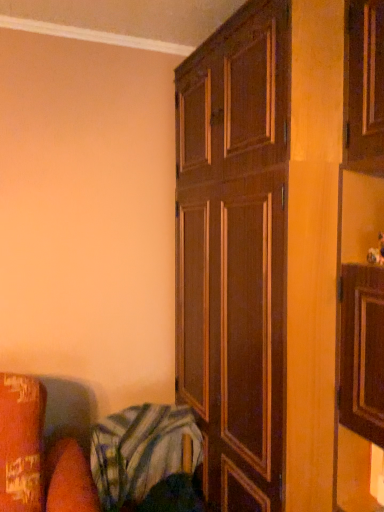
Consider the image. What is the approximate width of striped cotton blanket at lower left?

It is 12.51 inches.

Describe the element at coordinates (146, 460) in the screenshot. This screenshot has height=512, width=384. I see `striped cotton blanket at lower left` at that location.

Consider the image. Measure the distance between point [130,485] and camera.

Point [130,485] is 1.72 meters away from camera.

You are a GUI agent. You are given a task and a screenshot of the screen. Output one action in this format:
    pyautogui.click(x=<x>, y=<y>)
    Task: Click on the striped cotton blanket at lower left
    The width and height of the screenshot is (384, 512).
    Given the screenshot: What is the action you would take?
    pyautogui.click(x=146, y=460)

What do you see at coordinates (279, 248) in the screenshot?
I see `dark wood cupboard at center` at bounding box center [279, 248].

In order to face dark wood cupboard at center, should I rotate leftwards or rightwards?

Rotate your view right by about 11.640°.

Locate an element on the screen. dark wood cupboard at center is located at coordinates (279, 248).

Locate an element on the screen. This screenshot has width=384, height=512. striped cotton blanket at lower left is located at coordinates (146, 460).

Which is more to the right, striped cotton blanket at lower left or dark wood cupboard at center?

Positioned to the right is dark wood cupboard at center.

Between striped cotton blanket at lower left and dark wood cupboard at center, which one is positioned in front?

Positioned in front is dark wood cupboard at center.

Which is farther from the camera, [142,468] or [354,182]?

The point [142,468] is farther.

Based on the photo, from the image's perspective, which is below, striped cotton blanket at lower left or dark wood cupboard at center?

striped cotton blanket at lower left is shown below in the image.

From a real-world perspective, is striped cotton blanket at lower left on dark wood cupboard at center?

No, from a real-world perspective, striped cotton blanket at lower left is not over dark wood cupboard at center

Can you confirm if striped cotton blanket at lower left is thinner than dark wood cupboard at center?

Yes, striped cotton blanket at lower left is thinner than dark wood cupboard at center.

Which of these two, striped cotton blanket at lower left or dark wood cupboard at center, stands shorter?

Standing shorter between the two is striped cotton blanket at lower left.

Considering the relative sizes of striped cotton blanket at lower left and dark wood cupboard at center in the image provided, is striped cotton blanket at lower left bigger than dark wood cupboard at center?

No.

Is dark wood cupboard at center completely or partially inside striped cotton blanket at lower left?

No.

Does striped cotton blanket at lower left touch dark wood cupboard at center?

No, striped cotton blanket at lower left is not touching dark wood cupboard at center.

Is striped cotton blanket at lower left oriented away from dark wood cupboard at center?

striped cotton blanket at lower left is not turned away from dark wood cupboard at center.

How different are the orientations of striped cotton blanket at lower left and dark wood cupboard at center in degrees?

striped cotton blanket at lower left and dark wood cupboard at center are facing 90.8 degrees away from each other.

How much distance is there between striped cotton blanket at lower left and dark wood cupboard at center?

striped cotton blanket at lower left and dark wood cupboard at center are 21.15 inches apart.

Identify the location of cupboard above the striped cotton blanket at lower left (from a real-world perspective). This screenshot has height=512, width=384. (279, 248).

Considering the relative positions of dark wood cupboard at center and striped cotton blanket at lower left in the image provided, is dark wood cupboard at center to the right of striped cotton blanket at lower left from the viewer's perspective?

Yes, dark wood cupboard at center is to the right of striped cotton blanket at lower left.

From the picture: Considering the positions of objects dark wood cupboard at center and striped cotton blanket at lower left in the image provided, who is in front, dark wood cupboard at center or striped cotton blanket at lower left?

Positioned in front is dark wood cupboard at center.

Does point (179, 390) come farther from viewer compared to point (199, 460)?

Yes, point (179, 390) is farther from viewer.

From the image's perspective, which object appears higher, dark wood cupboard at center or striped cotton blanket at lower left?

dark wood cupboard at center is shown above in the image.

Looking at this image, from a real-world perspective, is dark wood cupboard at center located beneath striped cotton blanket at lower left?

No, from a real-world perspective, dark wood cupboard at center is not under striped cotton blanket at lower left.

Between dark wood cupboard at center and striped cotton blanket at lower left, which one has larger width?

dark wood cupboard at center is wider.

From their relative heights in the image, would you say dark wood cupboard at center is taller or shorter than striped cotton blanket at lower left?

Clearly, dark wood cupboard at center is taller compared to striped cotton blanket at lower left.

Can you confirm if dark wood cupboard at center is smaller than striped cotton blanket at lower left?

Incorrect, dark wood cupboard at center is not smaller in size than striped cotton blanket at lower left.

Is dark wood cupboard at center inside the boundaries of striped cotton blanket at lower left, or outside?

dark wood cupboard at center is located beyond the bounds of striped cotton blanket at lower left.

Is dark wood cupboard at center not close to striped cotton blanket at lower left?

dark wood cupboard at center is near striped cotton blanket at lower left, not far away.

Is dark wood cupboard at center oriented towards striped cotton blanket at lower left?

Yes, dark wood cupboard at center is aimed at striped cotton blanket at lower left.

At what (x,y) coordinates should I click in order to perform the action: click on blanket lying below the dark wood cupboard at center (from the image's perspective). Please return your answer as a coordinate pair (x, y). Looking at the image, I should click on (146, 460).

This screenshot has width=384, height=512. In the image, there is a dark wood cupboard at center. What are the coordinates of `blanket below it (from a real-world perspective)` in the screenshot? It's located at (146, 460).

Where is `blanket on the left of dark wood cupboard at center`? blanket on the left of dark wood cupboard at center is located at coordinates (146, 460).